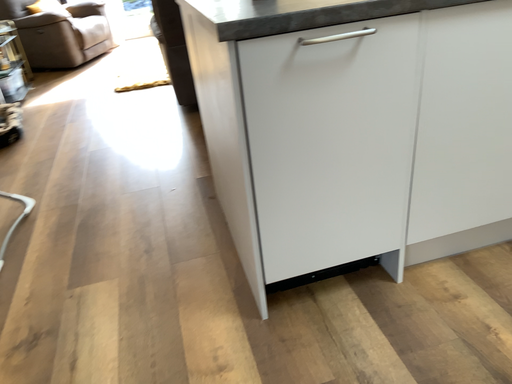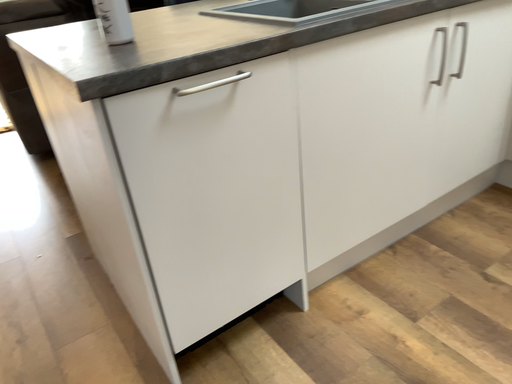
Question: How did the camera likely rotate when shooting the video?

Choices:
 (A) rotated left
 (B) rotated right

Answer: (B)